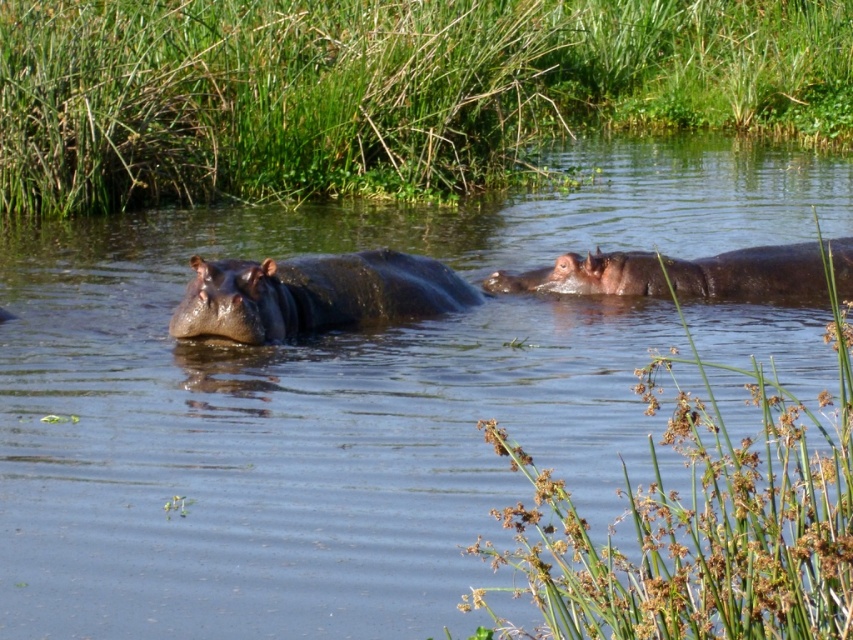
Question: Among these points, which one is nearest to the camera?

Choices:
 (A) (550, 273)
 (B) (383, 276)

Answer: (B)

Question: Does green grass at upper center have a greater width compared to brown matte hippo at right?

Choices:
 (A) no
 (B) yes

Answer: (B)

Question: Is green grass at upper center below brown matte hippo at right?

Choices:
 (A) yes
 (B) no

Answer: (B)

Question: Which point is closer to the camera?

Choices:
 (A) (753, 68)
 (B) (379, 304)
 (C) (840, 257)

Answer: (B)

Question: Is green grass at upper center bigger than brown matte hippo at right?

Choices:
 (A) yes
 (B) no

Answer: (A)

Question: Among these objects, which one is farthest from the camera?

Choices:
 (A) brown matte hippo at right
 (B) shiny brown hippo at center

Answer: (A)